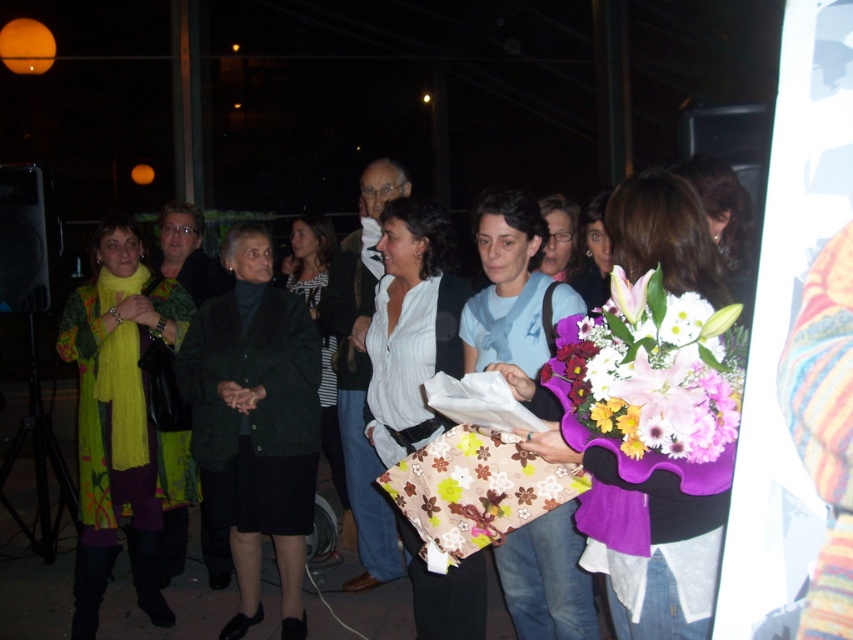
Does purple fabric bouquet at center appear on the right side of dark green fabric coat at center?

Correct, you'll find purple fabric bouquet at center to the right of dark green fabric coat at center.

Between purple fabric bouquet at center and dark green fabric coat at center, which one appears on the right side from the viewer's perspective?

Positioned to the right is purple fabric bouquet at center.

From the picture: Who is more forward, (611, 372) or (305, 282)?

Point (611, 372) is in front.

You are a GUI agent. You are given a task and a screenshot of the screen. Output one action in this format:
    pyautogui.click(x=<x>, y=<y>)
    Task: Click on the purple fabric bouquet at center
    The image size is (853, 640).
    Given the screenshot: What is the action you would take?
    pyautogui.click(x=648, y=372)

Can you confirm if green knitted sweater at left is shorter than purple fabric bouquet at center?

No, green knitted sweater at left is not shorter than purple fabric bouquet at center.

Which is below, green knitted sweater at left or purple fabric bouquet at center?

green knitted sweater at left

Does point (132, 236) lie behind point (650, 340)?

Yes.

Where is `green knitted sweater at left`? The image size is (853, 640). green knitted sweater at left is located at coordinates (122, 420).

Is white striped shirt at center to the left of matte floral bouquet at center from the viewer's perspective?

Yes, white striped shirt at center is to the left of matte floral bouquet at center.

Between point (395, 198) and point (665, 208), which one is positioned behind?

The point (395, 198) is more distant.

Identify the location of white striped shirt at center. The width and height of the screenshot is (853, 640). (410, 326).